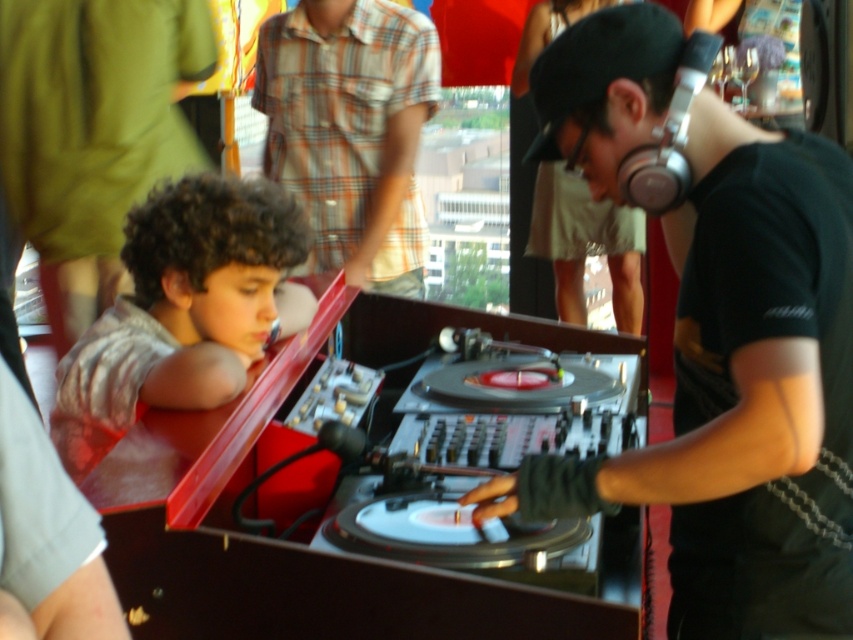
Question: Does curly-haired boy at left lie behind plaid shirt at upper center?

Choices:
 (A) no
 (B) yes

Answer: (A)

Question: Estimate the real-world distances between objects in this image. Which object is farther from the plaid shirt at upper center?

Choices:
 (A) curly-haired boy at left
 (B) black matte headphones at center

Answer: (B)

Question: Estimate the real-world distances between objects in this image. Which object is closer to the black matte headphones at center?

Choices:
 (A) curly-haired boy at left
 (B) plaid shirt at upper center

Answer: (A)

Question: Which of the following is the closest to the observer?

Choices:
 (A) black matte headphones at center
 (B) plaid shirt at upper center

Answer: (A)

Question: Is curly-haired boy at left to the right of plaid shirt at upper center from the viewer's perspective?

Choices:
 (A) yes
 (B) no

Answer: (B)

Question: Is black matte headphones at center to the right of plaid shirt at upper center from the viewer's perspective?

Choices:
 (A) no
 (B) yes

Answer: (B)